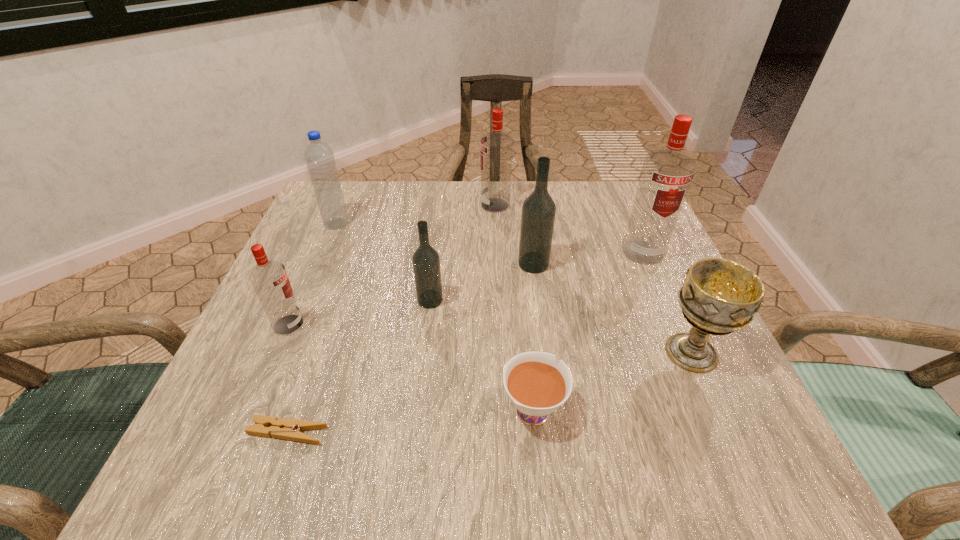
The width and height of the screenshot is (960, 540). In order to click on vodka that is the closest to the smallest red vodka in this screenshot , I will do `click(426, 262)`.

Identify which red vodka is the second nearest to the left black vodka. Please provide its 2D coordinates. Your answer should be formatted as a tuple, i.e. [(x, y)], where the tuple contains the x and y coordinates of a point satisfying the conditions above.

[(496, 147)]

Where is `red vodka that stands as the closest to the eighth nearest object`? Image resolution: width=960 pixels, height=540 pixels. red vodka that stands as the closest to the eighth nearest object is located at coordinates (269, 278).

This screenshot has height=540, width=960. I want to click on free space that satisfies the following two spatial constraints: 1. on the front label of the chalice; 2. on the right side of the biggest red vodka, so click(x=686, y=353).

Locate an element on the screen. blank space that satisfies the following two spatial constraints: 1. on the front label of the smallest red vodka; 2. on the side of the white teacup with the handle is located at coordinates (253, 407).

Where is `vacant space that satisfies the following two spatial constraints: 1. on the front label of the farthest object; 2. on the side of the teacup with the handle`? vacant space that satisfies the following two spatial constraints: 1. on the front label of the farthest object; 2. on the side of the teacup with the handle is located at coordinates (505, 407).

Find the location of a particular element. The image size is (960, 540). vacant position in the image that satisfies the following two spatial constraints: 1. on the front label of the second red vodka from right to left; 2. on the right side of the right black vodka is located at coordinates (498, 264).

You are a GUI agent. You are given a task and a screenshot of the screen. Output one action in this format:
    pyautogui.click(x=<x>, y=<y>)
    Task: Click on the vacant area in the image that satisfies the following two spatial constraints: 1. on the front label of the smallest red vodka; 2. on the side of the teacup with the handle
    The width and height of the screenshot is (960, 540).
    Given the screenshot: What is the action you would take?
    pyautogui.click(x=253, y=407)

This screenshot has width=960, height=540. What are the coordinates of `vacant area that satisfies the following two spatial constraints: 1. on the side of the second shortest object with the handle; 2. on the front label of the second smallest red vodka` in the screenshot? It's located at (513, 205).

Locate an element on the screen. This screenshot has width=960, height=540. vacant space that satisfies the following two spatial constraints: 1. on the side of the white teacup with the handle; 2. on the front label of the leftmost vodka is located at coordinates (524, 325).